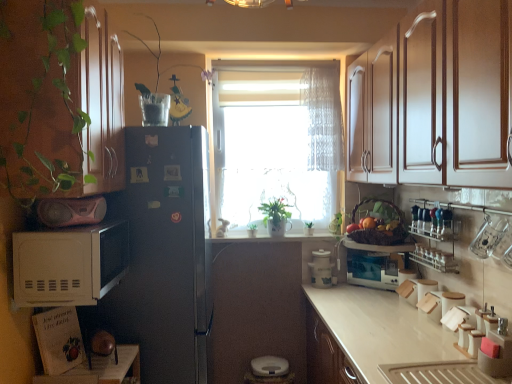
The width and height of the screenshot is (512, 384). I want to click on free space above white glossy countertop at lower right (from a real-world perspective), so click(x=378, y=326).